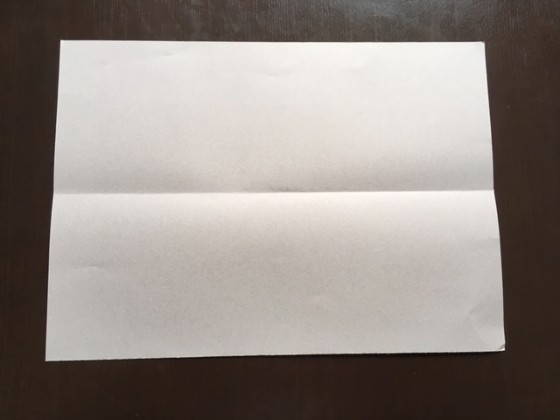
This screenshot has width=560, height=420. I want to click on table, so click(529, 34).